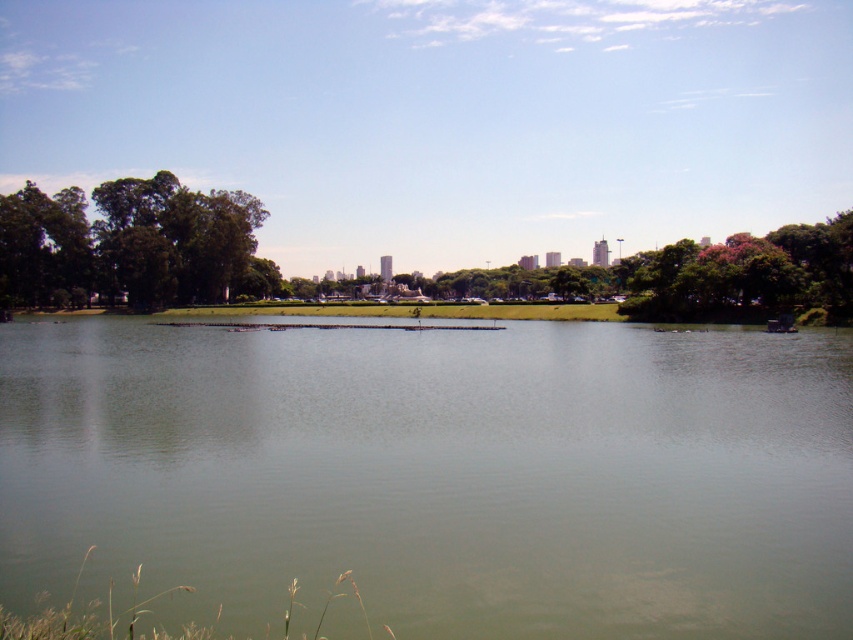
Which of these two, green smooth water at center or green leafy tree at left, stands shorter?

Standing shorter between the two is green smooth water at center.

Between green smooth water at center and green leafy tree at left, which one has more height?

green leafy tree at left

Is point (51, 483) positioned before point (189, 204)?

Yes, point (51, 483) is closer to viewer.

This screenshot has width=853, height=640. What are the coordinates of `green smooth water at center` in the screenshot? It's located at (437, 474).

Which is behind, point (242, 193) or point (836, 292)?

Positioned behind is point (242, 193).

Is point (86, 221) less distant than point (709, 294)?

No, it is not.

Identify the location of green leafy tree at left. The height and width of the screenshot is (640, 853). (131, 244).

Describe the element at coordinates (437, 474) in the screenshot. This screenshot has height=640, width=853. I see `green smooth water at center` at that location.

Is green smooth water at center positioned behind pink textured tree at right?

That is False.

Where is `green smooth water at center`? green smooth water at center is located at coordinates (437, 474).

The height and width of the screenshot is (640, 853). I want to click on green smooth water at center, so click(x=437, y=474).